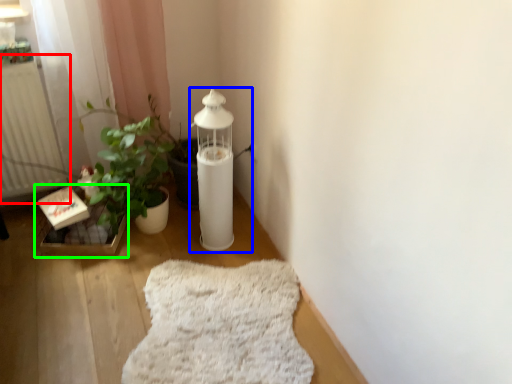
Question: Which object is positioned closest to radiator (highlighted by a red box)? Select from oil lamp (highlighted by a blue box) and window sill (highlighted by a green box).

Choices:
 (A) oil lamp
 (B) window sill

Answer: (B)